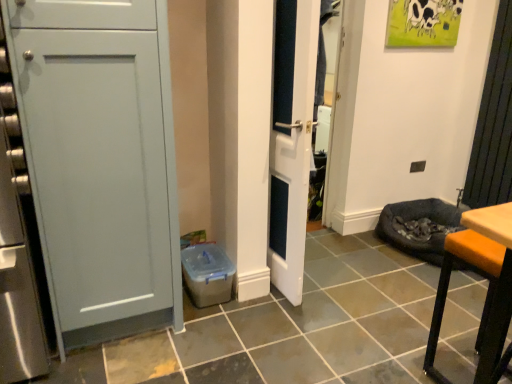
The height and width of the screenshot is (384, 512). Find the location of `vacant region in front of white glossy door at center`. vacant region in front of white glossy door at center is located at coordinates (275, 327).